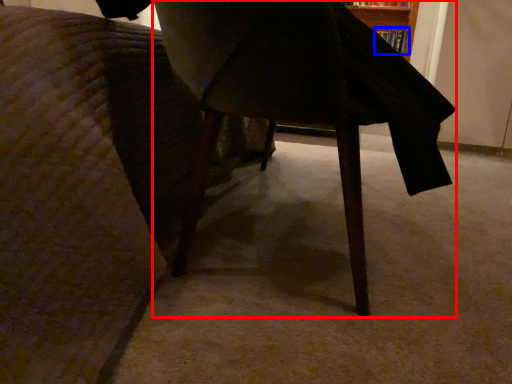
Question: Among these objects, which one is farthest to the camera, table (highlighted by a red box) or book (highlighted by a blue box)?

Choices:
 (A) table
 (B) book

Answer: (B)